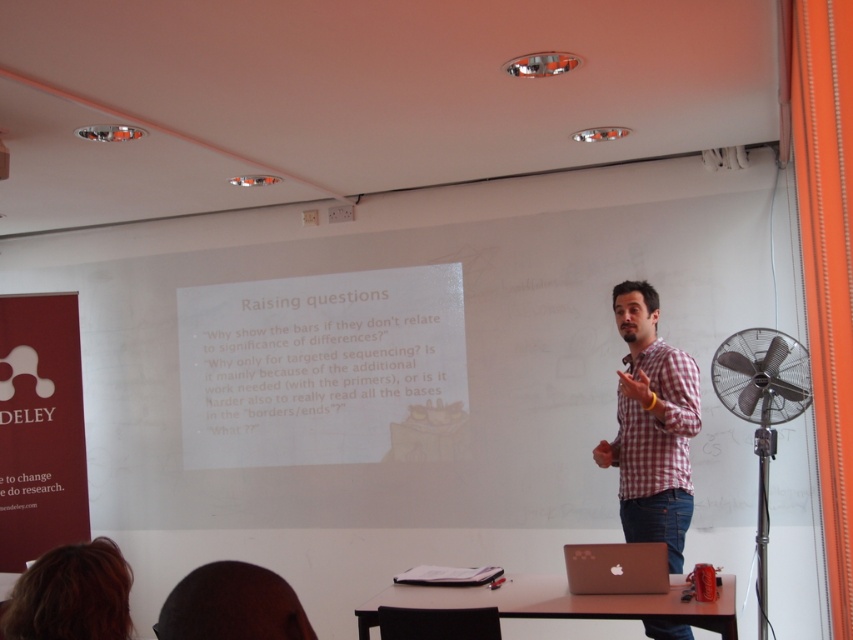
Question: Which point is farther from the camera taking this photo?

Choices:
 (A) (682, 636)
 (B) (625, 333)
 (C) (257, 620)
 (D) (596, 563)

Answer: (B)

Question: Which object is positioned farthest from the checkered fabric shirt at center?

Choices:
 (A) satin gold laptop at center
 (B) black matte microphone at center
 (C) dark hair at lower left

Answer: (C)

Question: Considering the relative positions of satin gold laptop at center and black matte microphone at center in the image provided, where is satin gold laptop at center located with respect to black matte microphone at center?

Choices:
 (A) below
 (B) above

Answer: (A)

Question: Can you confirm if brown hair at lower left is positioned to the left of dark hair at lower left?

Choices:
 (A) yes
 (B) no

Answer: (A)

Question: In this image, where is satin gold laptop at center located relative to black matte microphone at center?

Choices:
 (A) right
 (B) left

Answer: (B)

Question: Which point is closer to the camera?

Choices:
 (A) (256, 618)
 (B) (662, 592)
 (C) (625, 326)

Answer: (A)